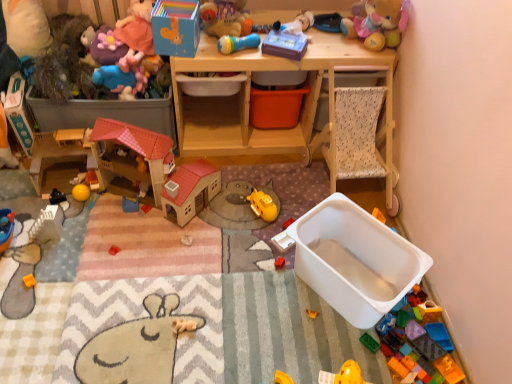
At what (x,y) coordinates should I click in order to perform the action: click on free space behind translucent plastic car at lower right, placed as the 12th toy when sorted from left to right. Please return your answer as a coordinate pair (x, y). This screenshot has width=512, height=384. Looking at the image, I should click on (418, 294).